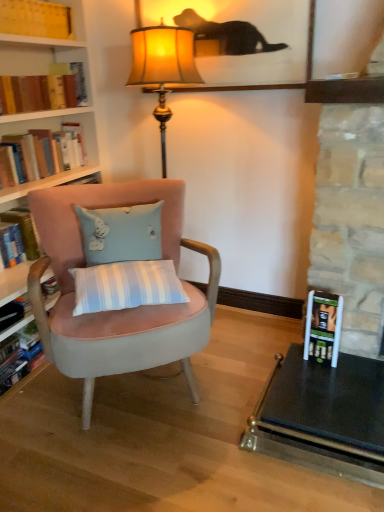
Question: From the image's perspective, is hardcover book at left, arranged as the second book when ordered from the bottom, above hardcover book at lower right?

Choices:
 (A) no
 (B) yes

Answer: (B)

Question: Is hardcover book at left, arranged as the second book when ordered from the bottom, shorter than hardcover book at lower right?

Choices:
 (A) yes
 (B) no

Answer: (A)

Question: Is hardcover book at left, arranged as the second book when ordered from the bottom, facing away from hardcover book at lower right?

Choices:
 (A) no
 (B) yes

Answer: (A)

Question: Is hardcover book at left, arranged as the second book when ordered from the bottom, in front of hardcover book at lower right?

Choices:
 (A) no
 (B) yes

Answer: (A)

Question: Is hardcover book at left, arranged as the second book when ordered from the bottom, located outside hardcover book at lower right?

Choices:
 (A) no
 (B) yes

Answer: (B)

Question: Can you confirm if hardcover book at left, arranged as the second book when ordered from the bottom, is taller than hardcover book at lower right?

Choices:
 (A) yes
 (B) no

Answer: (B)

Question: Is hardcover book at left, which ranks as the 4th book in bottom-to-top order, outside yellow paper book at upper left, which ranks as the first book in top-to-bottom order?

Choices:
 (A) no
 (B) yes

Answer: (B)

Question: From the image's perspective, does hardcover book at left, the second book positioned from the top, appear lower than yellow paper book at upper left, which ranks as the first book in top-to-bottom order?

Choices:
 (A) no
 (B) yes

Answer: (B)

Question: From the image's perspective, would you say hardcover book at left, which ranks as the 4th book in bottom-to-top order, is positioned over yellow paper book at upper left, the fifth book in the bottom-to-top sequence?

Choices:
 (A) no
 (B) yes

Answer: (A)

Question: Is the depth of hardcover book at left, the second book positioned from the top, less than that of yellow paper book at upper left, the fifth book in the bottom-to-top sequence?

Choices:
 (A) yes
 (B) no

Answer: (B)

Question: Is hardcover book at left, which ranks as the 4th book in bottom-to-top order, turned away from yellow paper book at upper left, which ranks as the first book in top-to-bottom order?

Choices:
 (A) no
 (B) yes

Answer: (A)

Question: From a real-world perspective, is hardcover book at left, the second book positioned from the top, over yellow paper book at upper left, which ranks as the first book in top-to-bottom order?

Choices:
 (A) no
 (B) yes

Answer: (A)

Question: From a real-world perspective, is hardcover book at left, marked as the 5th book in a top-to-bottom arrangement, below hardcover books at left, positioned as the third book in top-to-bottom order?

Choices:
 (A) no
 (B) yes

Answer: (B)